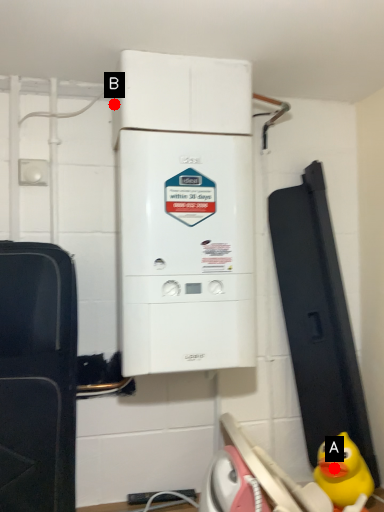
Question: Two points are circled on the image, labeled by A and B beside each circle. Which point is farther to the camera?

Choices:
 (A) A is further
 (B) B is further

Answer: (A)